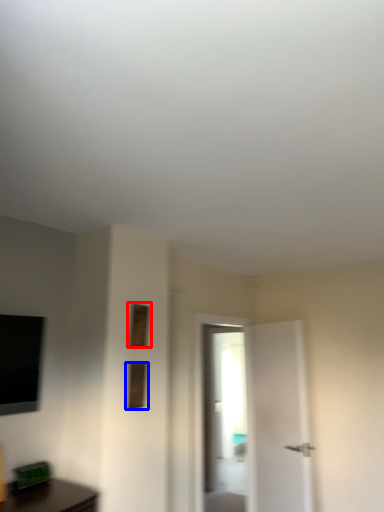
Question: Which object appears closest to the camera in this image, window (highlighted by a red box) or window (highlighted by a blue box)?

Choices:
 (A) window
 (B) window

Answer: (B)